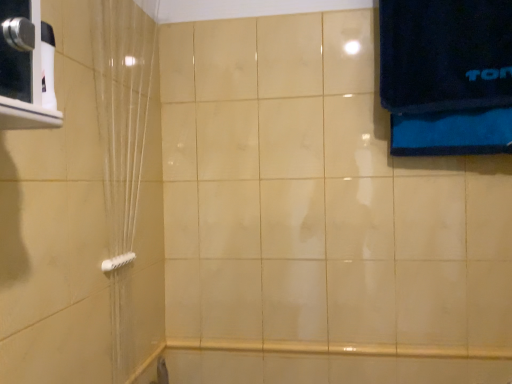
Where is `white plastic towel bar at lower left`? white plastic towel bar at lower left is located at coordinates (117, 261).

Image resolution: width=512 pixels, height=384 pixels. What do you see at coordinates (117, 261) in the screenshot?
I see `white plastic towel bar at lower left` at bounding box center [117, 261].

This screenshot has width=512, height=384. What do you see at coordinates (123, 105) in the screenshot?
I see `translucent plastic shower curtain at left` at bounding box center [123, 105].

Locate an element on the screen. This screenshot has width=512, height=384. translucent plastic shower curtain at left is located at coordinates (123, 105).

The width and height of the screenshot is (512, 384). Identify the location of white plastic towel bar at lower left. (117, 261).

Based on their positions, is translucent plastic shower curtain at left located to the left or right of white plastic towel bar at lower left?

Clearly, translucent plastic shower curtain at left is on the right of white plastic towel bar at lower left in the image.

Between translucent plastic shower curtain at left and white plastic towel bar at lower left, which one is positioned behind?

white plastic towel bar at lower left.

Which is less distant, (127, 233) or (121, 260)?

Point (127, 233).

Looking at this image, from the image's perspective, between translucent plastic shower curtain at left and white plastic towel bar at lower left, which one is located above?

translucent plastic shower curtain at left, from the image's perspective.

From a real-world perspective, between translucent plastic shower curtain at left and white plastic towel bar at lower left, who is vertically higher?

In real-world perspective, translucent plastic shower curtain at left is above.

Between translucent plastic shower curtain at left and white plastic towel bar at lower left, which one has smaller width?

white plastic towel bar at lower left.

Which of these two, translucent plastic shower curtain at left or white plastic towel bar at lower left, stands taller?

translucent plastic shower curtain at left.

Can you confirm if translucent plastic shower curtain at left is bigger than white plastic towel bar at lower left?

Yes, translucent plastic shower curtain at left is bigger than white plastic towel bar at lower left.

Would you say translucent plastic shower curtain at left is outside white plastic towel bar at lower left?

That's correct, translucent plastic shower curtain at left is outside of white plastic towel bar at lower left.

Is translucent plastic shower curtain at left with white plastic towel bar at lower left?

No.

Is translucent plastic shower curtain at left positioned with its back to white plastic towel bar at lower left?

Yes, translucent plastic shower curtain at left is facing away from white plastic towel bar at lower left.

What are the coordinates of `towel bar behind the translucent plastic shower curtain at left` in the screenshot? It's located at (117, 261).

In the image, is white plastic towel bar at lower left on the left side or the right side of translucent plastic shower curtain at left?

Based on their positions, white plastic towel bar at lower left is located to the left of translucent plastic shower curtain at left.

Is the depth of white plastic towel bar at lower left greater than that of translucent plastic shower curtain at left?

Yes, white plastic towel bar at lower left is further from the viewer.

Is point (113, 257) behind point (115, 363)?

No.

From the image's perspective, which is below, white plastic towel bar at lower left or translucent plastic shower curtain at left?

From the image's view, white plastic towel bar at lower left is below.

Looking at this image, from a real-world perspective, between white plastic towel bar at lower left and translucent plastic shower curtain at left, who is vertically lower?

In real-world perspective, white plastic towel bar at lower left is lower.

Can you confirm if white plastic towel bar at lower left is wider than translucent plastic shower curtain at left?

No, white plastic towel bar at lower left is not wider than translucent plastic shower curtain at left.

Considering the relative sizes of white plastic towel bar at lower left and translucent plastic shower curtain at left in the image provided, is white plastic towel bar at lower left taller than translucent plastic shower curtain at left?

No, white plastic towel bar at lower left is not taller than translucent plastic shower curtain at left.

Between white plastic towel bar at lower left and translucent plastic shower curtain at left, which one has smaller size?

white plastic towel bar at lower left.

Does white plastic towel bar at lower left contain translucent plastic shower curtain at left?

No, translucent plastic shower curtain at left is not a part of white plastic towel bar at lower left.

Is there a large distance between white plastic towel bar at lower left and translucent plastic shower curtain at left?

white plastic towel bar at lower left is actually quite close to translucent plastic shower curtain at left.

Is white plastic towel bar at lower left oriented towards translucent plastic shower curtain at left?

Yes, white plastic towel bar at lower left is facing translucent plastic shower curtain at left.

Can you tell me how much white plastic towel bar at lower left and translucent plastic shower curtain at left differ in facing direction?

3.2 degrees.

This screenshot has height=384, width=512. What are the coordinates of `shower curtain on the right of white plastic towel bar at lower left` in the screenshot? It's located at (123, 105).

Identify the location of shower curtain lying above the white plastic towel bar at lower left (from the image's perspective). This screenshot has height=384, width=512. (123, 105).

The width and height of the screenshot is (512, 384). What are the coordinates of `towel bar below the translucent plastic shower curtain at left (from the image's perspective)` in the screenshot? It's located at (117, 261).